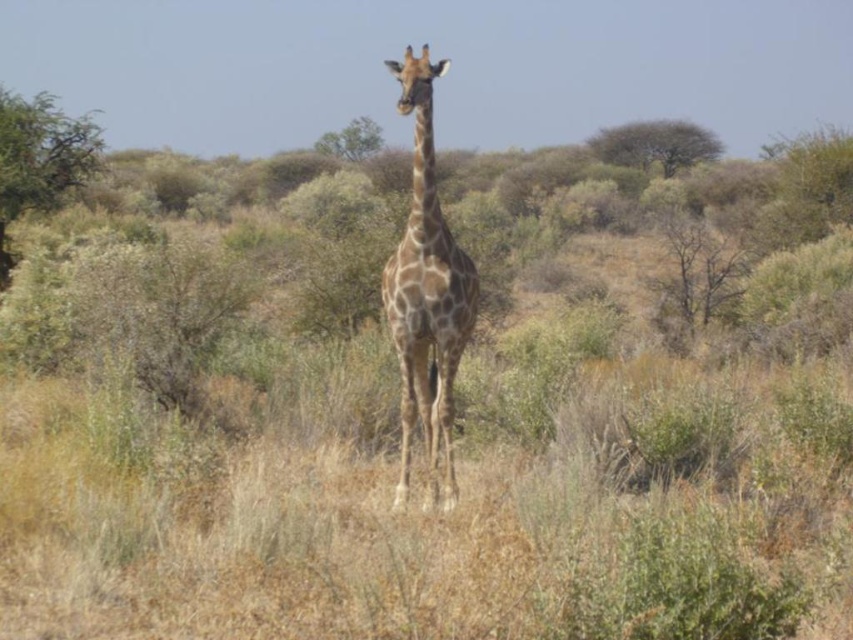
Question: Does green leafy shrub at left have a larger size compared to green leafy tree at center?

Choices:
 (A) no
 (B) yes

Answer: (B)

Question: Among these objects, which one is nearest to the camera?

Choices:
 (A) spotted fur giraffe at center
 (B) green leafy tree at center
 (C) green leafy shrub at left
 (D) brown textured tree at upper center

Answer: (A)

Question: Which point is closer to the camera?

Choices:
 (A) (714, 147)
 (B) (70, 116)

Answer: (A)

Question: Does green leafy shrub at left have a larger size compared to green leafy tree at center?

Choices:
 (A) no
 (B) yes

Answer: (B)

Question: Estimate the real-world distances between objects in this image. Which object is farther from the spotted fur giraffe at center?

Choices:
 (A) green leafy tree at center
 (B) brown textured tree at upper center

Answer: (B)

Question: Is the position of spotted fur giraffe at center more distant than that of green leafy shrub at left?

Choices:
 (A) no
 (B) yes

Answer: (A)